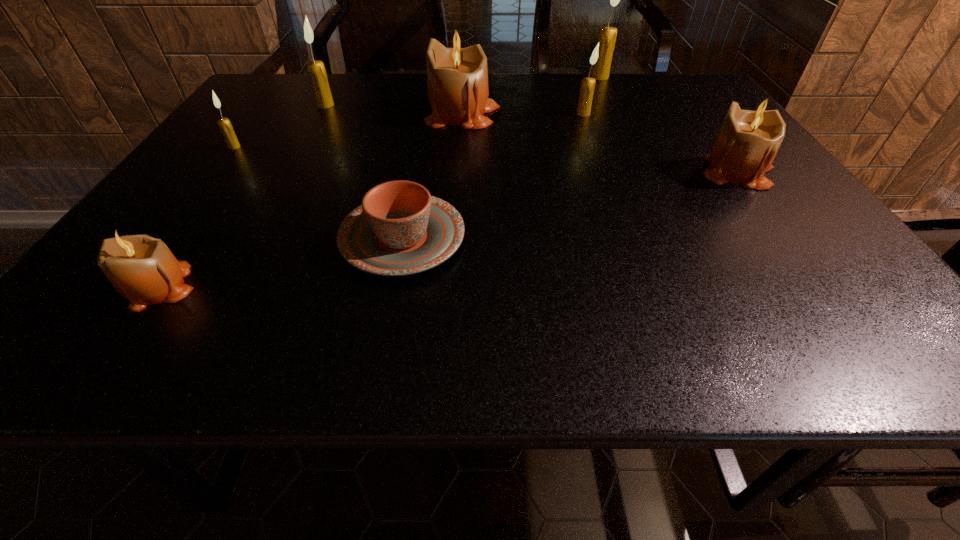
I want to click on the second object from right to left, so click(607, 35).

You are a GUI agent. You are given a task and a screenshot of the screen. Output one action in this format:
    pyautogui.click(x=<x>, y=<y>)
    Task: Click on the farthest candle
    This screenshot has width=960, height=540.
    Given the screenshot: What is the action you would take?
    pyautogui.click(x=607, y=35)

Find the location of a particular element. the second cream candle from left to right is located at coordinates (316, 69).

The width and height of the screenshot is (960, 540). What are the coordinates of `the third smallest cream candle` in the screenshot? It's located at (x=316, y=69).

Where is `the farthest beige candle`? The image size is (960, 540). the farthest beige candle is located at coordinates (457, 77).

Locate an element on the screen. This screenshot has height=540, width=960. the fourth candle from left to right is located at coordinates (457, 77).

Locate an element on the screen. The width and height of the screenshot is (960, 540). the sixth object from left to right is located at coordinates (588, 84).

At what (x,y) coordinates should I click in order to perform the action: click on the third farthest cream candle. Please return your answer as a coordinate pair (x, y). Image resolution: width=960 pixels, height=540 pixels. Looking at the image, I should click on (588, 84).

You are a GUI agent. You are given a task and a screenshot of the screen. Output one action in this format:
    pyautogui.click(x=<x>, y=<y>)
    Task: Click on the second nearest candle
    The image size is (960, 540).
    Given the screenshot: What is the action you would take?
    pyautogui.click(x=748, y=140)

Locate an element on the screen. This screenshot has height=540, width=960. the sixth farthest object is located at coordinates 748,140.